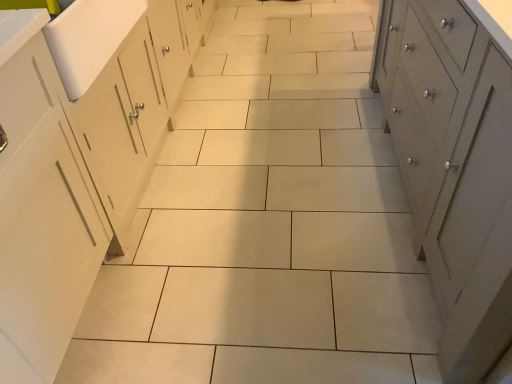
Question: Is white painted wood cabinet at right not close to white glossy sink at left?

Choices:
 (A) no
 (B) yes

Answer: (B)

Question: Does white painted wood cabinet at right have a greater height compared to white glossy sink at left?

Choices:
 (A) yes
 (B) no

Answer: (A)

Question: Is white painted wood cabinet at right located outside white glossy sink at left?

Choices:
 (A) yes
 (B) no

Answer: (A)

Question: Considering the relative sizes of white painted wood cabinet at right and white glossy sink at left in the image provided, is white painted wood cabinet at right shorter than white glossy sink at left?

Choices:
 (A) no
 (B) yes

Answer: (A)

Question: From a real-world perspective, is white painted wood cabinet at right positioned over white glossy sink at left based on gravity?

Choices:
 (A) no
 (B) yes

Answer: (A)

Question: From a real-world perspective, does white painted wood cabinet at right sit lower than white glossy sink at left?

Choices:
 (A) no
 (B) yes

Answer: (B)

Question: Is white glossy sink at left facing towards white painted wood cabinet at right?

Choices:
 (A) yes
 (B) no

Answer: (A)

Question: From the image's perspective, is white glossy sink at left below white painted wood cabinet at right?

Choices:
 (A) yes
 (B) no

Answer: (B)

Question: Is white painted wood cabinet at right inside white glossy sink at left?

Choices:
 (A) no
 (B) yes

Answer: (A)

Question: Is white glossy sink at left looking in the opposite direction of white painted wood cabinet at right?

Choices:
 (A) no
 (B) yes

Answer: (A)

Question: Is white glossy sink at left at the left side of white painted wood cabinet at right?

Choices:
 (A) yes
 (B) no

Answer: (A)

Question: Considering the relative sizes of white glossy sink at left and white painted wood cabinet at right in the image provided, is white glossy sink at left bigger than white painted wood cabinet at right?

Choices:
 (A) no
 (B) yes

Answer: (A)

Question: Is white painted wood cabinet at right wider or thinner than white glossy sink at left?

Choices:
 (A) wide
 (B) thin

Answer: (A)